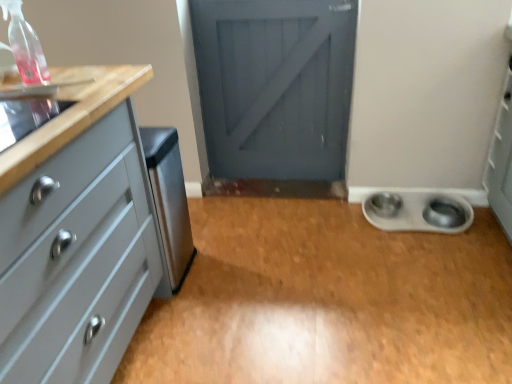
In order to click on vacant area that lies to the right of stainless steel trash can at left, the 2th appliance viewed from the right in this screenshot , I will do `click(218, 265)`.